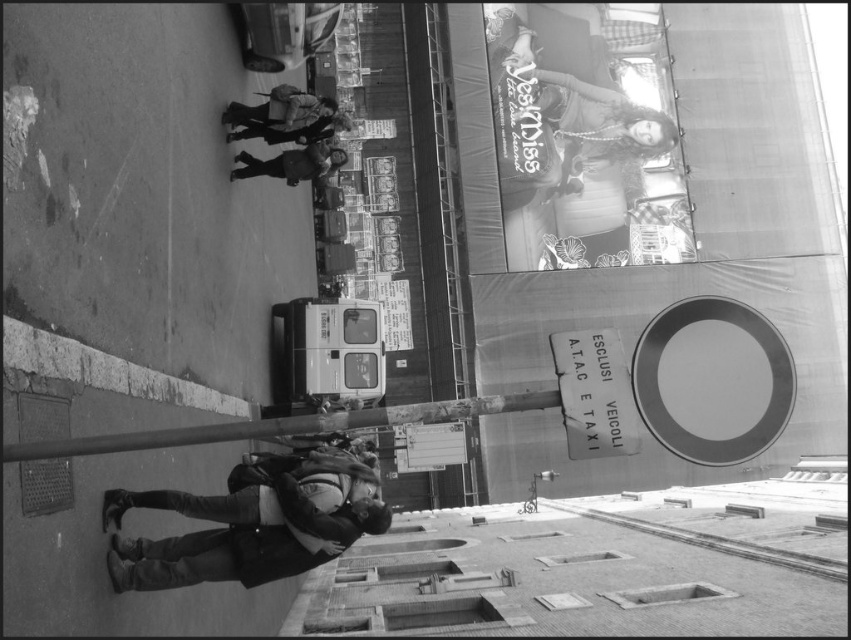
You are a city planner assessing the safety of this urban space. Considering the distance between the smooth metal pole at center and the dark gray jacket at center, which is occupied by a pedestrian, is there enough space for a 6.5 feet wide emergency vehicle to pass between them?

The distance between the smooth metal pole at center and the dark gray jacket at center is 73.18 feet. Since the emergency vehicle is only 6.5 feet wide, there is ample space for it to pass between them.

You are a photographer standing at the center of the street in the image. You want to place a small decoration exactly at the point marked by the smooth metal pole at center. Given that the pole is located at coordinates point (283, 426), can you determine whether this point is closer to the bottom or the top of the image?

The point marked by the smooth metal pole at center is located at coordinates (283, 426). In standard image coordinate systems, the y coordinate determines vertical position, with 0 being the top and 1 the bottom. Since the y value here is 0.333, which is closer to 0 than to 1, the point is closer to the top of the image.

You are a photographer standing in the middle of the street. You notice a smooth metal pole at center and a dark gray jacket at center in the scene. Which object appears taller in the photo?

The dark gray jacket at center appears taller than the smooth metal pole at center in the photo.